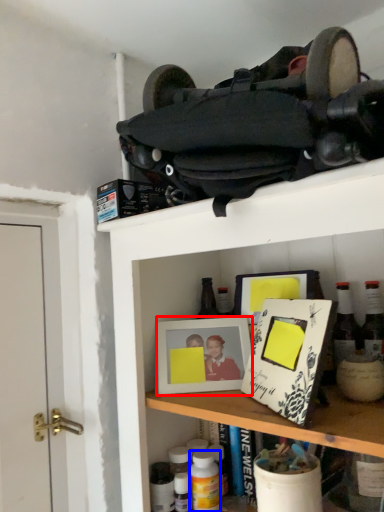
Question: Which object is further to the camera taking this photo, picture frame (highlighted by a red box) or bottle (highlighted by a blue box)?

Choices:
 (A) picture frame
 (B) bottle

Answer: (A)